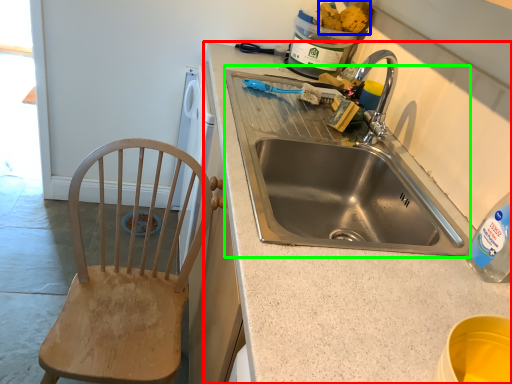
Question: Considering the real-world distances, which object is farthest from countertop (highlighted by a red box)? food (highlighted by a blue box) or sink (highlighted by a green box)?

Choices:
 (A) food
 (B) sink

Answer: (A)